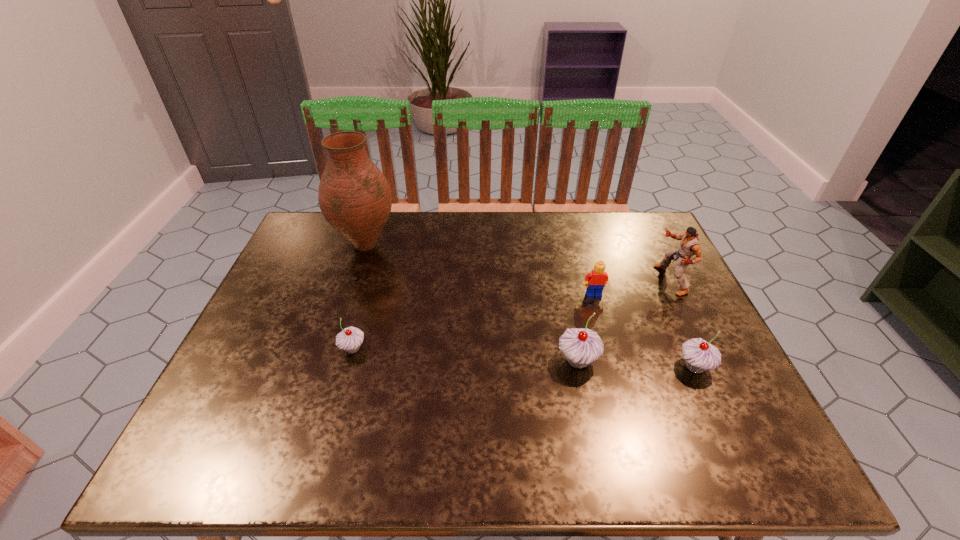
The height and width of the screenshot is (540, 960). Identify the location of the leftmost cupcake. (349, 339).

This screenshot has width=960, height=540. Find the location of `the tallest cupcake`. the tallest cupcake is located at coordinates (581, 346).

This screenshot has height=540, width=960. I want to click on the second cupcake from left to right, so tap(581, 346).

Locate an element on the screen. the rightmost cupcake is located at coordinates (699, 355).

Where is `the tallest object`? the tallest object is located at coordinates (355, 198).

At what (x,y) coordinates should I click in order to perform the action: click on Lego. Please return your answer as a coordinate pair (x, y). The image size is (960, 540). Looking at the image, I should click on tap(597, 278).

At what (x,y) coordinates should I click in order to perform the action: click on puncher. Please return your answer as a coordinate pair (x, y). This screenshot has height=540, width=960. Looking at the image, I should click on (689, 245).

Where is `free spot located on the left of the leftmost cupcake`? Image resolution: width=960 pixels, height=540 pixels. free spot located on the left of the leftmost cupcake is located at coordinates [246, 349].

Locate an element on the screen. vacant area located on the front of the tallest cupcake is located at coordinates (587, 402).

You are a GUI agent. You are given a task and a screenshot of the screen. Output one action in this format:
    pyautogui.click(x=<x>, y=<y>)
    Task: Click on the vacant area situated 0.270m on the left of the rightmost cupcake
    
    Given the screenshot: What is the action you would take?
    pyautogui.click(x=558, y=367)